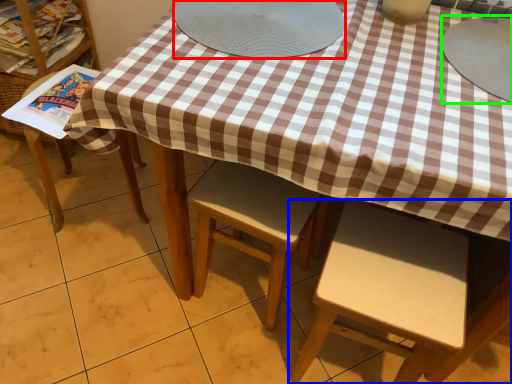
Question: Estimate the real-world distances between objects in this image. Which object is farther from platter (highlighted by a red box), chair (highlighted by a blue box) or tableware (highlighted by a green box)?

Choices:
 (A) chair
 (B) tableware

Answer: (A)